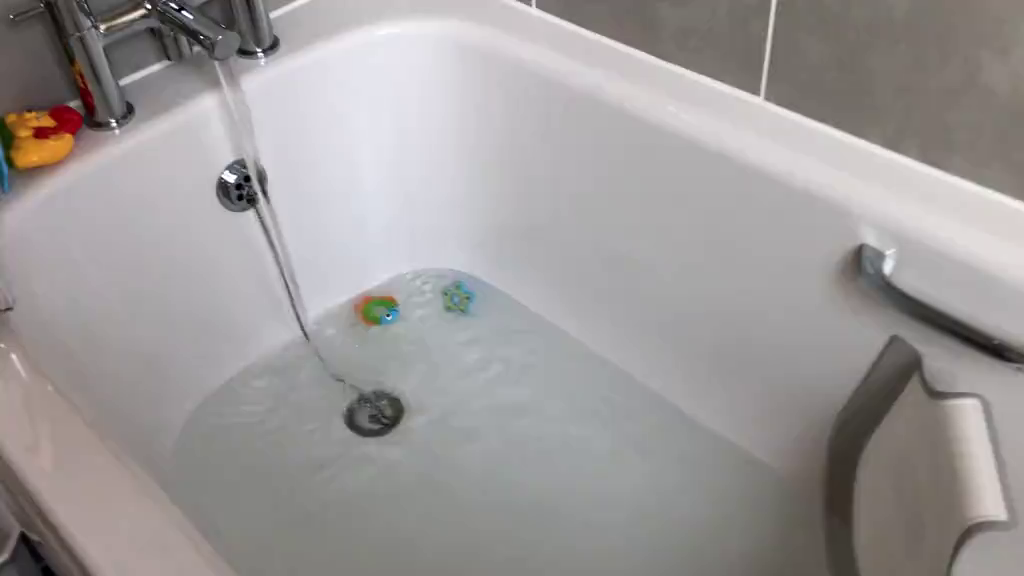
Where is `toys with green and blue colors`? This screenshot has height=576, width=1024. toys with green and blue colors is located at coordinates coord(377,306), coord(452,306).